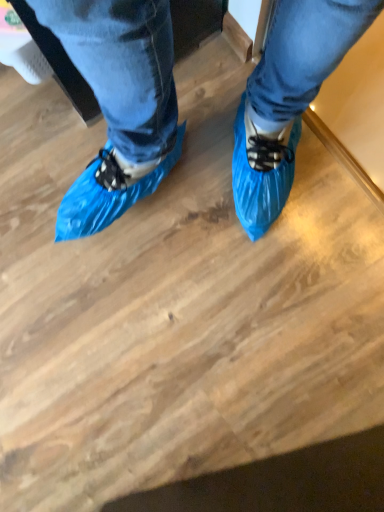
Where is `vacant space in front of denim at center`? vacant space in front of denim at center is located at coordinates (109, 146).